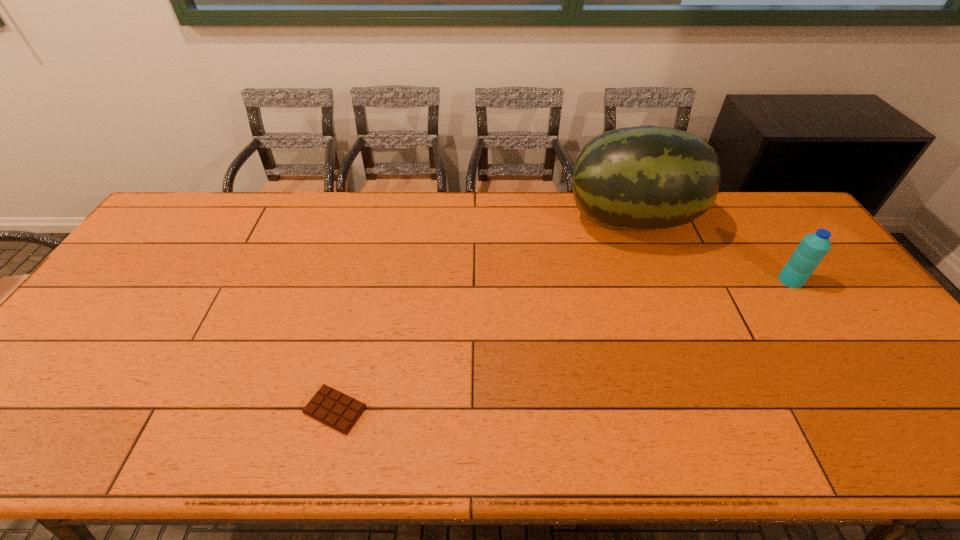
This screenshot has width=960, height=540. I want to click on object that is at the near edge, so click(x=333, y=408).

Where is `object that is at the right edge`? This screenshot has width=960, height=540. object that is at the right edge is located at coordinates (812, 249).

Locate an element on the screen. free spot at the far edge of the desktop is located at coordinates (698, 234).

Where is `blank space at the right edge`? The image size is (960, 540). blank space at the right edge is located at coordinates (941, 405).

Identify the location of vacant space at the far left corner of the desktop. (200, 220).

This screenshot has width=960, height=540. Identify the location of free space at the far right corner. (783, 235).

At what (x,y) coordinates should I click in order to perform the action: click on free area in between the farthest object and the nearest object. Please return your answer as a coordinate pair (x, y). This screenshot has width=960, height=540. Looking at the image, I should click on (483, 315).

This screenshot has width=960, height=540. Find the location of `vacant space that is in between the nearest object and the second farthest object`. vacant space that is in between the nearest object and the second farthest object is located at coordinates (563, 345).

The width and height of the screenshot is (960, 540). I want to click on vacant space in between the farthest object and the second farthest object, so click(x=710, y=250).

Identify the location of free space between the second shortest object and the candy bar. (563, 345).